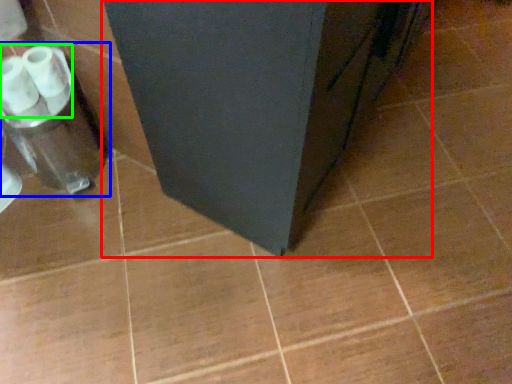
Question: Estimate the real-world distances between objects in this image. Which object is closer to furniture (highlighted by a red box), blender (highlighted by a blue box) or toilet paper (highlighted by a green box)?

Choices:
 (A) blender
 (B) toilet paper

Answer: (A)